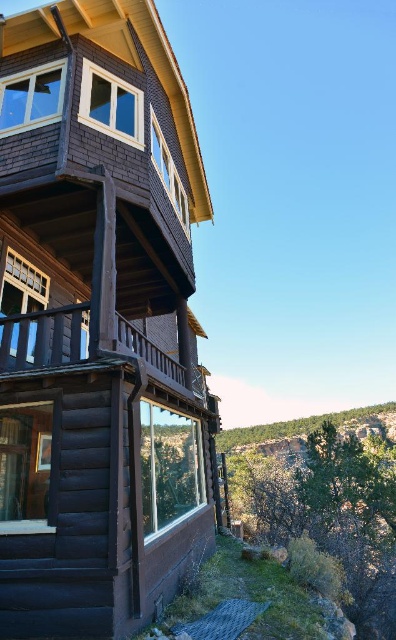
You are a painter who wants to place a ladder between the brown wooden balcony at upper left and the green mossy rock at lower right. Which object is narrower so that the ladder can be placed closer to it?

The brown wooden balcony at upper left is thinner than the green mossy rock at lower right, so the ladder should be placed closer to the brown wooden balcony at upper left.

You are standing in front of the dark brown wood cabin at left and want to access the brown wooden balcony at upper left. Which direction should you move to reach the balcony?

The dark brown wood cabin at left is positioned over the brown wooden balcony at upper left, so you should move upward to reach the balcony.